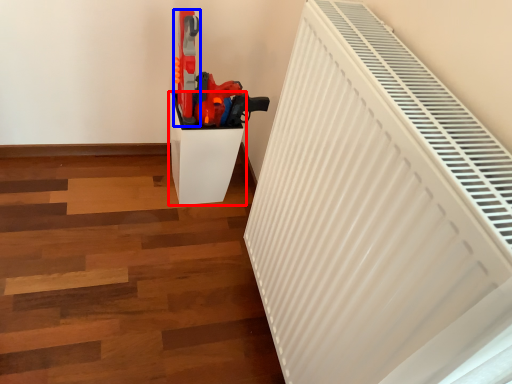
Question: Among these objects, which one is farthest to the camera, furniture (highlighted by a red box) or equipment (highlighted by a blue box)?

Choices:
 (A) furniture
 (B) equipment

Answer: (A)